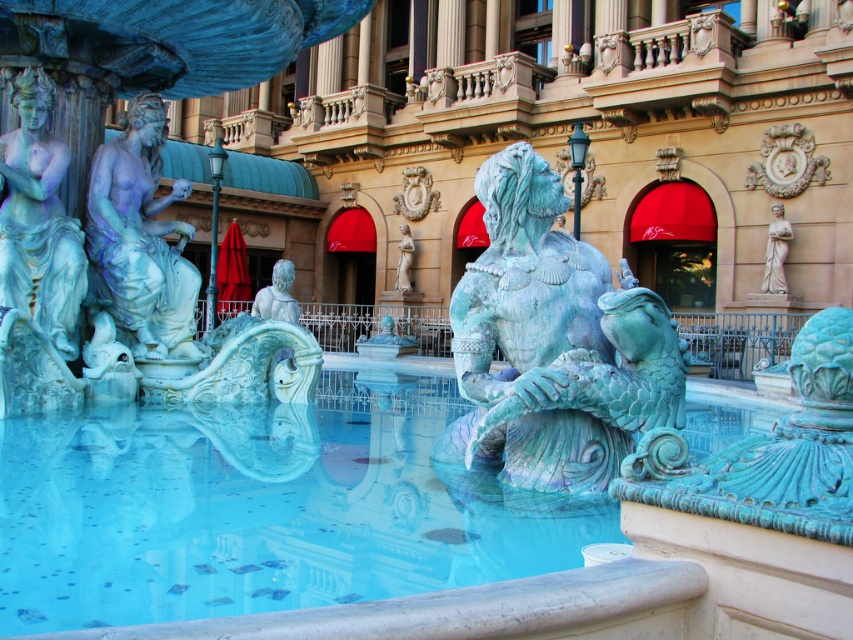
Question: In this image, where is matte blue statue at left located relative to white marble statue at upper right?

Choices:
 (A) above
 (B) below

Answer: (B)

Question: Which is nearer to the turquoise stone fountain at center?

Choices:
 (A) white marble statue at center
 (B) matte blue statue at left

Answer: (B)

Question: Which is nearer to the white marble statue at upper right?

Choices:
 (A) turquoise stone fountain at center
 (B) green patina statue at center
 (C) blue-green patina statue at left

Answer: (B)

Question: Which point is closer to the camera taking this photo?

Choices:
 (A) (412, 252)
 (B) (788, 225)
 (C) (65, 323)

Answer: (C)

Question: Does blue-green patina statue at left have a larger size compared to green patina statue at center?

Choices:
 (A) no
 (B) yes

Answer: (A)

Question: Does blue-green patina statue at left have a lesser width compared to white marble statue at upper right?

Choices:
 (A) yes
 (B) no

Answer: (A)